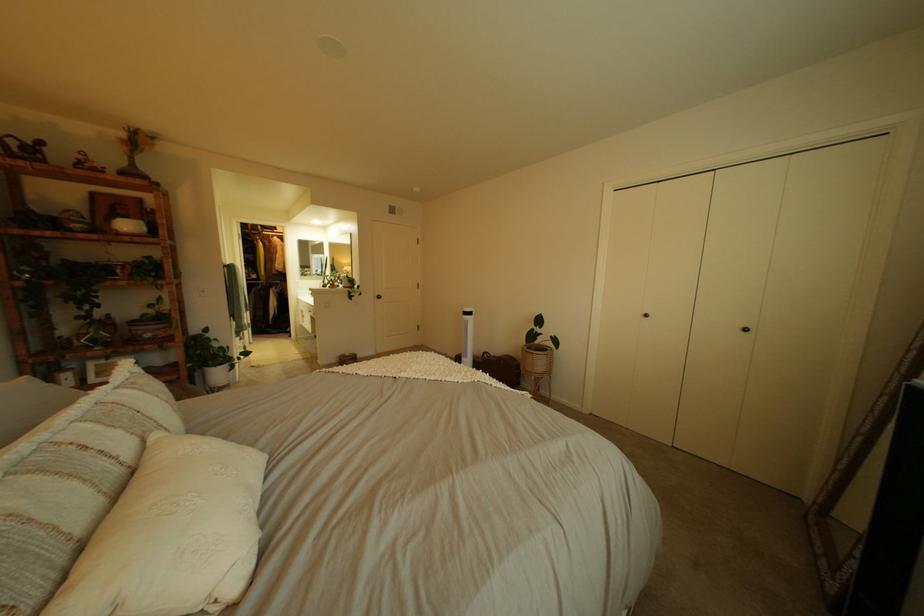
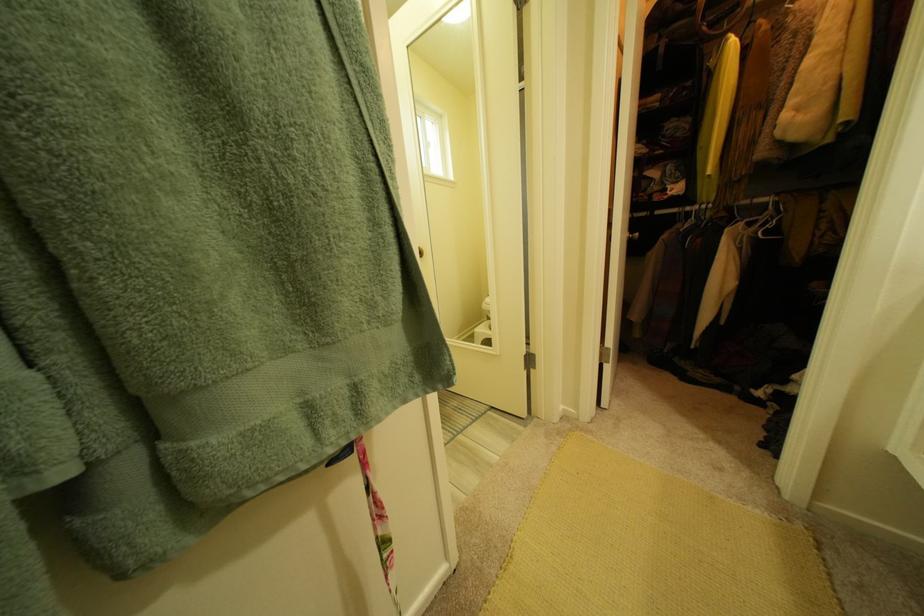
Locate, in the second image, the point that corresponds to [293,283] in the first image.

(777, 201)